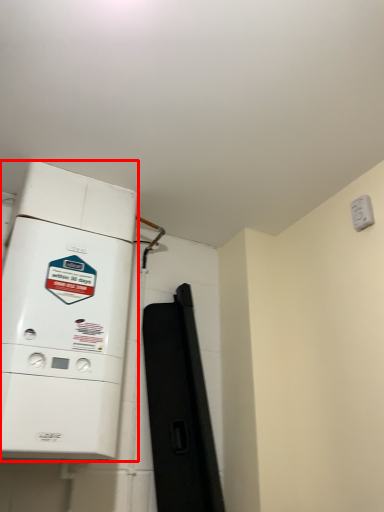
Question: From the image's perspective, what is the correct spatial positioning of home appliance (annotated by the red box) in reference to electric outlet?

Choices:
 (A) below
 (B) above

Answer: (A)